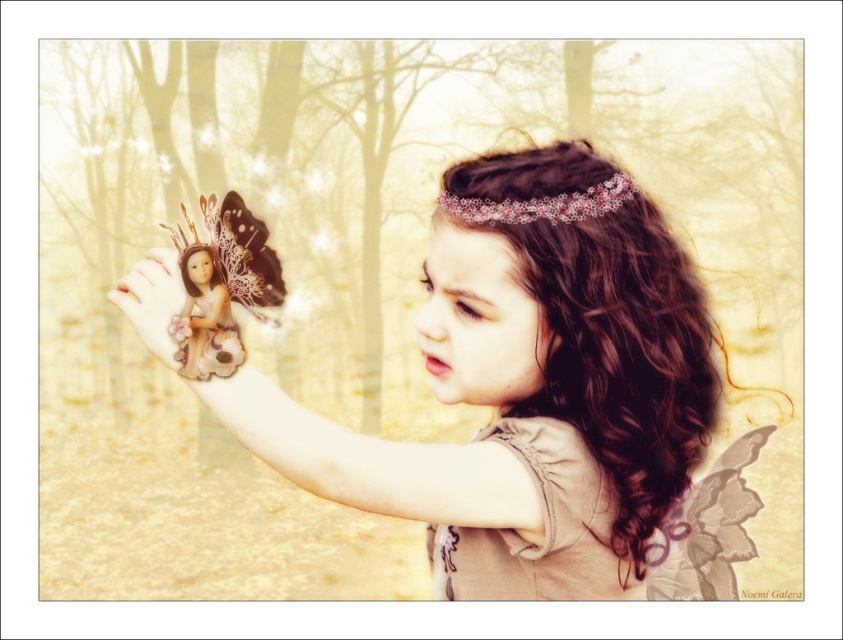
Does matte brown fairy doll at upper left appear on the left side of pink lace tiara at upper center?

No, matte brown fairy doll at upper left is not to the left of pink lace tiara at upper center.

Which is above, matte brown fairy doll at upper left or pink lace tiara at upper center?

pink lace tiara at upper center

Which is in front, point (561, 296) or point (611, 209)?

Positioned in front is point (561, 296).

In order to click on matte brown fairy doll at upper left in this screenshot , I will do `click(541, 417)`.

Between point (191, 276) and point (165, 314), which one is positioned in front?

Point (165, 314)

Between point (173, 336) and point (173, 369), which one is positioned behind?

Positioned behind is point (173, 369).

Image resolution: width=843 pixels, height=640 pixels. What are the coordinates of `smooth porcelain doll at center` in the screenshot? It's located at (205, 317).

Does matte brown fairy doll at upper left lie in front of smooth porcelain doll at center?

That is True.

Can you confirm if matte brown fairy doll at upper left is thinner than smooth porcelain doll at center?

No.

Describe the element at coordinates (541, 417) in the screenshot. I see `matte brown fairy doll at upper left` at that location.

The width and height of the screenshot is (843, 640). Identify the location of matte brown fairy doll at upper left. (541, 417).